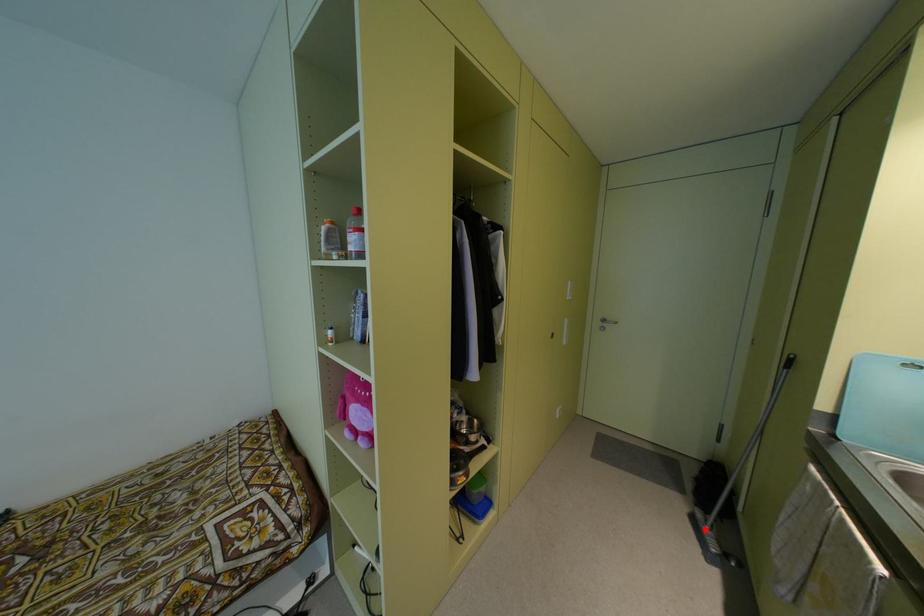
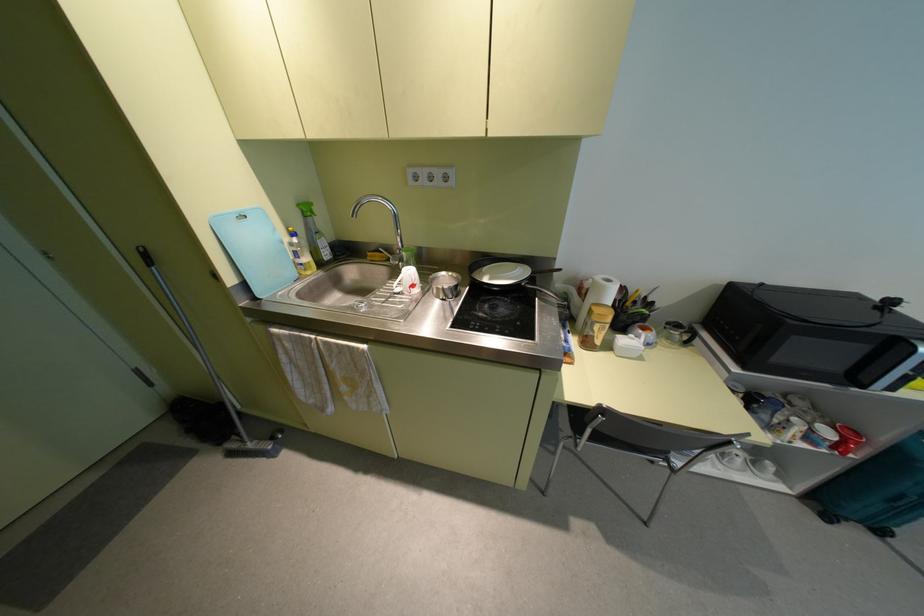
Question: I am providing you with two images of the same scene from different viewpoints. A red point is shown in image1. For the corresponding object point in image2, is it positioned nearer or farther from the camera?

Choices:
 (A) Nearer
 (B) Farther

Answer: (A)